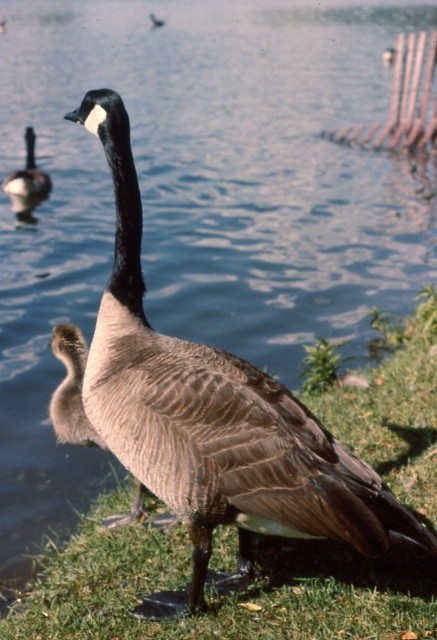
You are a birdwatcher observing the scene. You notice the brown feathered goose at center and the brown feathered duckling at upper left. Which one is positioned more to the right side of the image?

The brown feathered goose at center is positioned more to the right side of the image than the brown feathered duckling at upper left.

You are a birdwatcher observing the scene. You notice the brown matte duck at center and the brown feathered duckling at upper left. Which one is positioned lower in the image?

The brown matte duck at center is located below the brown feathered duckling at upper left, so the brown matte duck at center is positioned lower in the image.

You are a photographer trying to capture a closeup shot of the brown matte duck at center and the brown feathered duckling at upper left. You want to ensure both subjects are in focus. Given that your camera can only focus on one subject at a time, which one should you prioritize focusing on to maximize the chances of both being in focus?

Since the brown matte duck at center is wider than the brown feathered duckling at upper left, focusing on the wider brown matte duck at center would increase the likelihood of both being in focus as it occupies more space in the frame.